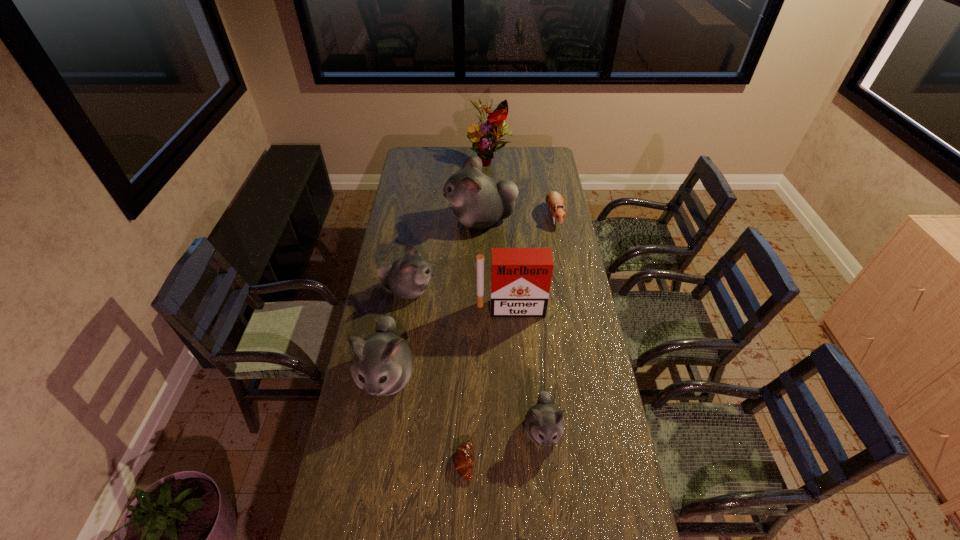
Locate an element on the screen. vacant space located on the face of the second shortest hamster is located at coordinates (551, 512).

Locate an element on the screen. The width and height of the screenshot is (960, 540). vacant area situated at the face of the second shortest object is located at coordinates click(562, 257).

This screenshot has width=960, height=540. In order to click on vacant space positioned on the left of the crescent roll in this screenshot , I will do `click(416, 462)`.

The image size is (960, 540). I want to click on object that is at the far edge, so click(491, 131).

Image resolution: width=960 pixels, height=540 pixels. I want to click on object located at the right edge, so click(554, 200).

What are the coordinates of `vacant space at the left edge of the desktop` in the screenshot? It's located at (388, 247).

The width and height of the screenshot is (960, 540). In the image, there is a desktop. What are the coordinates of `vacant space at the right edge` in the screenshot? It's located at (612, 492).

This screenshot has height=540, width=960. In the image, there is a desktop. In order to click on vacant space at the far right corner in this screenshot , I will do `click(545, 154)`.

The height and width of the screenshot is (540, 960). Find the location of `vacant area between the smallest white hamster and the farthest white hamster`. vacant area between the smallest white hamster and the farthest white hamster is located at coordinates (512, 325).

I want to click on vacant area between the crescent roll and the biggest white hamster, so click(472, 341).